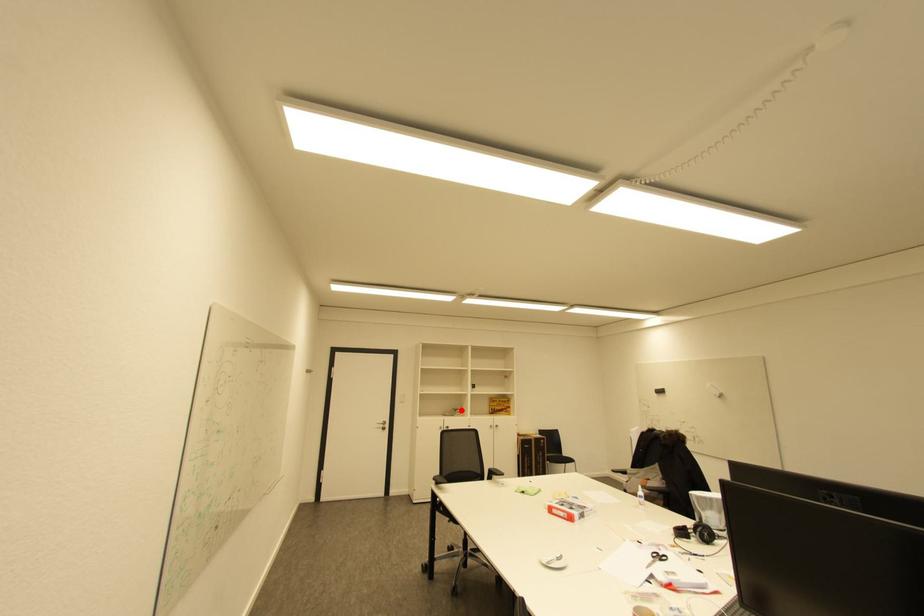
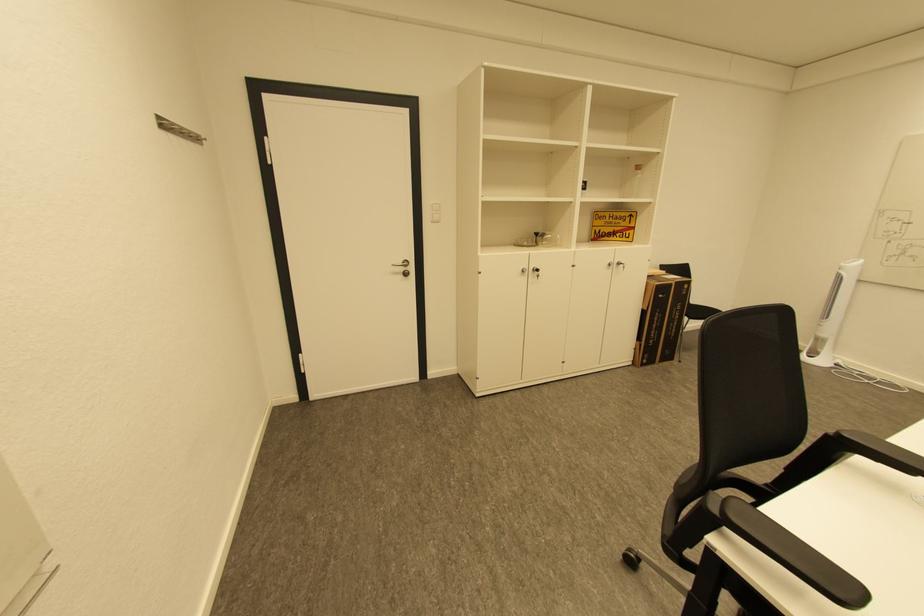
The point at the highlighted location is marked in the first image. Where is the corresponding point in the second image?

(543, 235)